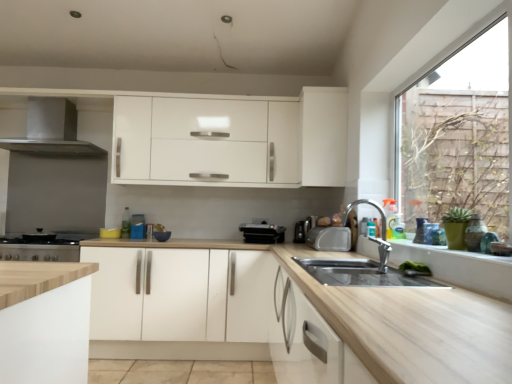
Question: Is satin silver exhaust hood at left to the right of white matte cabinet at upper center, which appears as the second cabinetry when viewed from the left, from the viewer's perspective?

Choices:
 (A) no
 (B) yes

Answer: (A)

Question: From the image's perspective, would you say satin silver exhaust hood at left is shown under white matte cabinet at upper center, which ranks as the 2th cabinetry in bottom-to-top order?

Choices:
 (A) yes
 (B) no

Answer: (B)

Question: Is satin silver exhaust hood at left positioned before white matte cabinet at upper center, acting as the first cabinetry starting from the right?

Choices:
 (A) yes
 (B) no

Answer: (B)

Question: Could you tell me if satin silver exhaust hood at left is facing white matte cabinet at upper center, which appears as the second cabinetry when viewed from the left?

Choices:
 (A) no
 (B) yes

Answer: (A)

Question: Is satin silver exhaust hood at left not close to white matte cabinet at upper center, which ranks as the 2th cabinetry in bottom-to-top order?

Choices:
 (A) no
 (B) yes

Answer: (B)

Question: Choose the correct answer: Is white matte cabinet at upper center, which ranks as the 2th cabinetry in bottom-to-top order, inside white matte cabinet at center, marked as the second cabinetry in a right-to-left arrangement, or outside it?

Choices:
 (A) inside
 (B) outside

Answer: (B)

Question: In terms of width, does white matte cabinet at upper center, acting as the first cabinetry starting from the right, look wider or thinner when compared to white matte cabinet at center, which appears as the 2th cabinetry when viewed from the top?

Choices:
 (A) wide
 (B) thin

Answer: (B)

Question: Considering the relative positions of white matte cabinet at upper center, which ranks as the 2th cabinetry in bottom-to-top order, and white matte cabinet at center, marked as the second cabinetry in a right-to-left arrangement, in the image provided, is white matte cabinet at upper center, which ranks as the 2th cabinetry in bottom-to-top order, to the left or to the right of white matte cabinet at center, marked as the second cabinetry in a right-to-left arrangement,?

Choices:
 (A) right
 (B) left

Answer: (A)

Question: Relative to white matte cabinet at center, which appears as the 2th cabinetry when viewed from the top, is white matte cabinet at upper center, acting as the first cabinetry starting from the right, in front or behind?

Choices:
 (A) front
 (B) behind

Answer: (B)

Question: Considering the positions of point (91, 147) and point (474, 258), is point (91, 147) closer or farther from the camera than point (474, 258)?

Choices:
 (A) farther
 (B) closer

Answer: (A)

Question: Is satin silver exhaust hood at left in front of or behind white wood window sill at lower right in the image?

Choices:
 (A) behind
 (B) front

Answer: (A)

Question: In terms of size, does satin silver exhaust hood at left appear bigger or smaller than white wood window sill at lower right?

Choices:
 (A) small
 (B) big

Answer: (B)

Question: From the image's perspective, is satin silver exhaust hood at left positioned above or below white wood window sill at lower right?

Choices:
 (A) below
 (B) above

Answer: (B)

Question: Considering the positions of white matte cabinet at upper center, acting as the first cabinetry starting from the right, and black plastic toaster at center, the second appliance in the left-to-right sequence, in the image, is white matte cabinet at upper center, acting as the first cabinetry starting from the right, bigger or smaller than black plastic toaster at center, the second appliance in the left-to-right sequence,?

Choices:
 (A) big
 (B) small

Answer: (A)

Question: In the image, is white matte cabinet at upper center, the 1th cabinetry viewed from the top, positioned in front of or behind black plastic toaster at center, the second appliance in the left-to-right sequence?

Choices:
 (A) front
 (B) behind

Answer: (A)